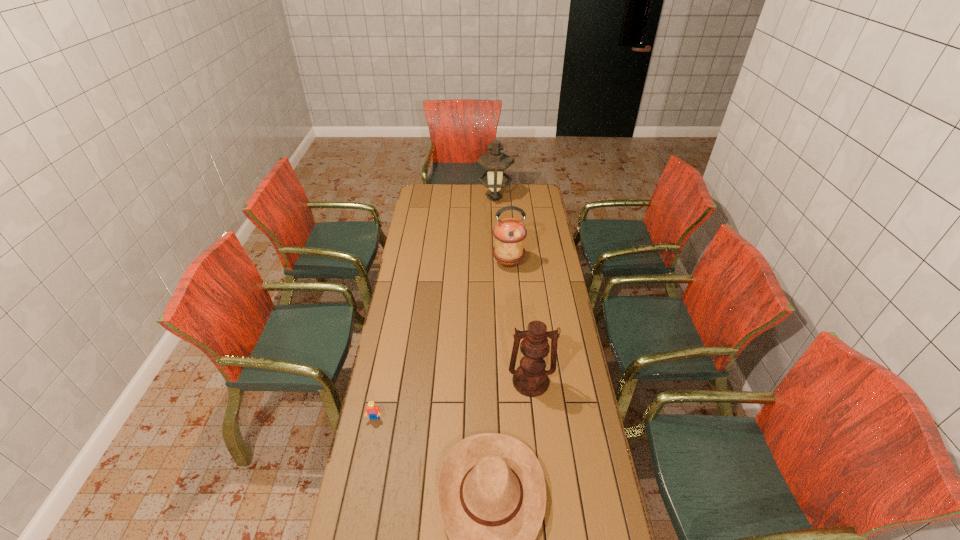
Find the location of a particular element. This screenshot has height=540, width=960. the farthest oil lamp is located at coordinates [495, 162].

Locate an element on the screen. Image resolution: width=960 pixels, height=540 pixels. the second nearest oil lamp is located at coordinates (509, 233).

This screenshot has width=960, height=540. Find the location of `the third nearest object`. the third nearest object is located at coordinates (531, 379).

You are a GUI agent. You are given a task and a screenshot of the screen. Output one action in this format:
    pyautogui.click(x=<x>, y=<y>)
    Task: Click on the Lego
    
    Given the screenshot: What is the action you would take?
    pyautogui.click(x=373, y=411)

The width and height of the screenshot is (960, 540). Find the location of `the leftmost object`. the leftmost object is located at coordinates (373, 411).

What are the coordinates of `vacant space situated 0.070m on the front of the farthest object` in the screenshot? It's located at (495, 213).

The height and width of the screenshot is (540, 960). I want to click on vacant space located on the left of the second farthest object, so click(x=464, y=262).

The height and width of the screenshot is (540, 960). What are the coordinates of `free location located 0.280m on the left of the third nearest object` in the screenshot? It's located at (434, 381).

What are the coordinates of `vacant region located on the face of the Lego` in the screenshot? It's located at (355, 516).

The width and height of the screenshot is (960, 540). Find the location of `object that is at the far edge`. object that is at the far edge is located at coordinates (495, 162).